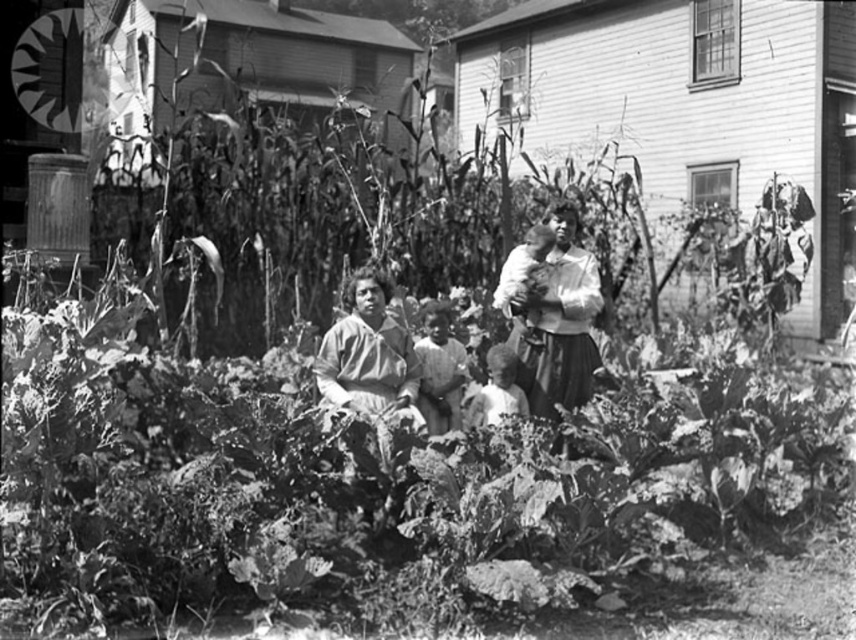
Question: Among these objects, which one is nearest to the camera?

Choices:
 (A) matte brown dress at center
 (B) smooth white shirt at center
 (C) light skin/soft fabric child at center
 (D) smooth skin baby at center

Answer: (A)

Question: Among these objects, which one is farthest from the camera?

Choices:
 (A) smooth white shirt at center
 (B) smooth skin baby at center
 (C) matte brown dress at center

Answer: (A)

Question: Which point appears farthest from the camera in this image?

Choices:
 (A) (377, 381)
 (B) (510, 401)
 (C) (516, 262)
 (D) (563, 256)

Answer: (D)

Question: Is light skin/soft fabric child at center bigger than smooth skin baby at center?

Choices:
 (A) no
 (B) yes

Answer: (B)

Question: Does light skin/soft fabric child at center have a smaller size compared to smooth white shirt at center?

Choices:
 (A) no
 (B) yes

Answer: (A)

Question: Is light skin/soft fabric child at center thinner than smooth skin baby at center?

Choices:
 (A) yes
 (B) no

Answer: (A)